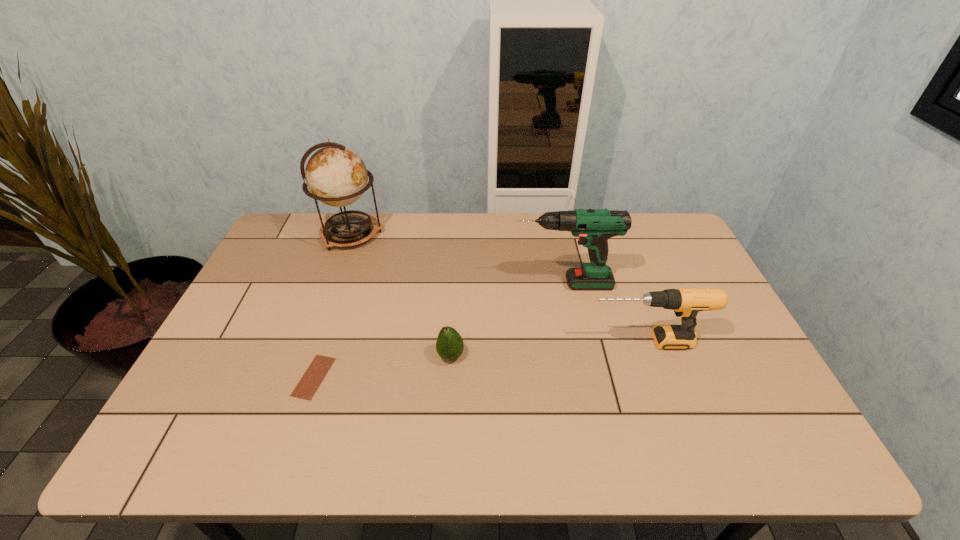
The height and width of the screenshot is (540, 960). I want to click on object present at the right edge, so click(x=686, y=302).

Where is `object that is at the far left corner`? Image resolution: width=960 pixels, height=540 pixels. object that is at the far left corner is located at coordinates (335, 175).

Where is `free location at the far edge`? The width and height of the screenshot is (960, 540). free location at the far edge is located at coordinates (509, 231).

This screenshot has height=540, width=960. In the image, there is a desktop. Identify the location of vacant space at the near edge. (464, 446).

The image size is (960, 540). Find the location of `vacant region at the left edge`. vacant region at the left edge is located at coordinates (255, 359).

Where is `blank space at the right edge`? This screenshot has height=540, width=960. blank space at the right edge is located at coordinates (732, 417).

The height and width of the screenshot is (540, 960). What are the coordinates of `free region at the far left corner of the desktop` in the screenshot? It's located at (306, 242).

I want to click on free space between the globe and the second farthest object, so click(457, 259).

In order to click on free point between the chocolate bar and the shorter drill in this screenshot , I will do `click(480, 359)`.

The height and width of the screenshot is (540, 960). What are the coordinates of `vacant space in between the tallest object and the nearer drill` in the screenshot? It's located at (499, 288).